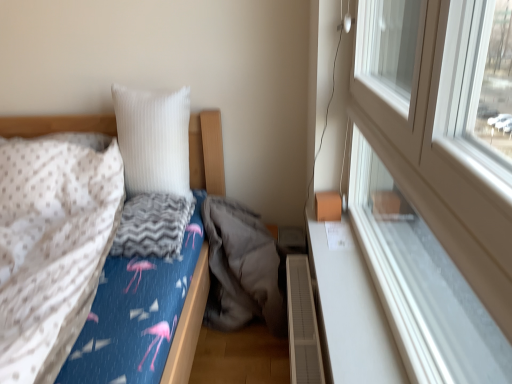
In order to click on white dotted fabric at left in this screenshot , I will do `click(52, 248)`.

What is the approximate width of white plastic window at upper right?

The width of white plastic window at upper right is 9.74 centimeters.

The image size is (512, 384). Describe the element at coordinates (302, 324) in the screenshot. I see `white plastic radiator at lower right` at that location.

Describe the element at coordinates (154, 140) in the screenshot. The image size is (512, 384). I see `white ribbed pillow at upper center` at that location.

The height and width of the screenshot is (384, 512). What do you see at coordinates (350, 313) in the screenshot?
I see `white smooth window sill at right` at bounding box center [350, 313].

Identify the location of gray zigzag blanket at center. (153, 226).

The image size is (512, 384). What do you see at coordinates (153, 226) in the screenshot?
I see `gray zigzag blanket at center` at bounding box center [153, 226].

This screenshot has height=384, width=512. What are the coordinates of `flamingo-patterned fabric bed at left` in the screenshot? It's located at tap(188, 325).

Image resolution: width=512 pixels, height=384 pixels. I want to click on white dotted fabric at left, so click(x=52, y=248).

Which is more to the right, flamingo-patterned fabric bed at left or gray soft sleeping bag at center?

gray soft sleeping bag at center is more to the right.

Is flamingo-patterned fabric bed at left positioned in front of gray soft sleeping bag at center?

Yes.

From a real-world perspective, is flamingo-patterned fabric bed at left located higher than gray soft sleeping bag at center?

Correct, in the physical world, flamingo-patterned fabric bed at left is higher than gray soft sleeping bag at center.

Based on the photo, is flamingo-patterned fabric bed at left wider than gray soft sleeping bag at center?

Correct, the width of flamingo-patterned fabric bed at left exceeds that of gray soft sleeping bag at center.

Which object is closer to the camera, gray soft sleeping bag at center or white smooth window sill at right?

Positioned in front is white smooth window sill at right.

From the picture: Can you confirm if gray soft sleeping bag at center is shorter than white smooth window sill at right?

No, gray soft sleeping bag at center is not shorter than white smooth window sill at right.

Does gray soft sleeping bag at center have a smaller size compared to white smooth window sill at right?

No.

Consider the image. Considering the positions of objects gray soft sleeping bag at center and white smooth window sill at right in the image provided, who is more to the left, gray soft sleeping bag at center or white smooth window sill at right?

gray soft sleeping bag at center.

Is point (170, 239) closer to camera compared to point (212, 193)?

Yes, it is.

In the image, is gray zigzag blanket at center positioned in front of or behind flamingo-patterned fabric bed at left?

gray zigzag blanket at center is behind flamingo-patterned fabric bed at left.

From the picture: Can you confirm if gray zigzag blanket at center is smaller than flamingo-patterned fabric bed at left?

Yes, gray zigzag blanket at center is smaller than flamingo-patterned fabric bed at left.

Considering the sizes of objects gray zigzag blanket at center and flamingo-patterned fabric bed at left in the image provided, who is taller, gray zigzag blanket at center or flamingo-patterned fabric bed at left?

flamingo-patterned fabric bed at left is taller.

From the image's perspective, is white smooth window sill at right over white plastic radiator at lower right?

Yes, from the image's perspective, white smooth window sill at right is over white plastic radiator at lower right.

Is white smooth window sill at right to the left of white plastic radiator at lower right from the viewer's perspective?

No, white smooth window sill at right is not to the left of white plastic radiator at lower right.

Between point (330, 251) and point (306, 343), which one is positioned in front?

Point (306, 343)

Would you consider white ribbed pillow at upper center to be distant from white plastic radiator at lower right?

No, white ribbed pillow at upper center is not far away from white plastic radiator at lower right.

How many degrees apart are the facing directions of white ribbed pillow at upper center and white plastic radiator at lower right?

white ribbed pillow at upper center and white plastic radiator at lower right are facing 89.7 degrees away from each other.

Is white ribbed pillow at upper center positioned with its back to white plastic radiator at lower right?

white ribbed pillow at upper center is not turned away from white plastic radiator at lower right.

Considering the relative sizes of white ribbed pillow at upper center and white plastic radiator at lower right in the image provided, is white ribbed pillow at upper center shorter than white plastic radiator at lower right?

No, white ribbed pillow at upper center is not shorter than white plastic radiator at lower right.

From a real-world perspective, between white plastic window at upper right and white smooth window sill at right, who is vertically higher?

white plastic window at upper right, from a real-world perspective.

From the image's perspective, is white plastic window at upper right on top of white smooth window sill at right?

Indeed, from the image's perspective, white plastic window at upper right is shown above white smooth window sill at right.

Between white plastic window at upper right and white smooth window sill at right, which one appears on the left side from the viewer's perspective?

From the viewer's perspective, white smooth window sill at right appears more on the left side.

How far apart are white dotted fabric at left and white smooth window sill at right?

white dotted fabric at left is 36.37 inches away from white smooth window sill at right.

From the image's perspective, which is below, white dotted fabric at left or white smooth window sill at right?

white smooth window sill at right appears lower in the image.

From a real-world perspective, is white dotted fabric at left above or below white smooth window sill at right?

In terms of real-world spatial position, white dotted fabric at left is above white smooth window sill at right.

Looking at this image, is white dotted fabric at left turned away from white smooth window sill at right?

No, white dotted fabric at left's orientation is not away from white smooth window sill at right.

Locate an element on the screen. This screenshot has height=384, width=512. sleeping bag above the flamingo-patterned fabric bed at left (from the image's perspective) is located at coordinates (241, 269).

This screenshot has height=384, width=512. Find the location of `window sill lying on the right of gray soft sleeping bag at center`. window sill lying on the right of gray soft sleeping bag at center is located at coordinates (350, 313).

Looking at the image, which one is located further to flamingo-patterned fabric bed at left, white ribbed pillow at upper center or white plastic radiator at lower right?

The object further to flamingo-patterned fabric bed at left is white ribbed pillow at upper center.

When comparing their distances from white dotted fabric at left, does white plastic radiator at lower right or white plastic window at upper right seem closer?

white plastic radiator at lower right.

Considering their positions, is white plastic window at upper right positioned further to white ribbed pillow at upper center than gray zigzag blanket at center?

white plastic window at upper right is further to white ribbed pillow at upper center.

Which object lies nearer to the anchor point gray soft sleeping bag at center, white plastic radiator at lower right or flamingo-patterned fabric bed at left?

flamingo-patterned fabric bed at left lies closer to gray soft sleeping bag at center than the other object.

From the image, which object appears to be nearer to white plastic radiator at lower right, white smooth window sill at right or flamingo-patterned fabric bed at left?

white smooth window sill at right lies closer to white plastic radiator at lower right than the other object.

Considering their positions, is white plastic radiator at lower right positioned closer to white smooth window sill at right than white dotted fabric at left?

white plastic radiator at lower right.

Considering their positions, is white smooth window sill at right positioned closer to gray soft sleeping bag at center than white dotted fabric at left?

white smooth window sill at right lies closer to gray soft sleeping bag at center than the other object.

Considering their positions, is white dotted fabric at left positioned further to white ribbed pillow at upper center than white smooth window sill at right?

Based on the image, white smooth window sill at right appears to be further to white ribbed pillow at upper center.

Locate an element on the screen. This screenshot has width=512, height=384. radiator situated between gray zigzag blanket at center and white smooth window sill at right from left to right is located at coordinates (302, 324).

Where is `blanket located between flamingo-patterned fabric bed at left and white smooth window sill at right in the left-right direction`? This screenshot has height=384, width=512. blanket located between flamingo-patterned fabric bed at left and white smooth window sill at right in the left-right direction is located at coordinates (52, 248).

Where is `window sill between white dotted fabric at left and white plastic window at upper right from left to right`? window sill between white dotted fabric at left and white plastic window at upper right from left to right is located at coordinates (350, 313).

At what (x,y) coordinates should I click in order to perform the action: click on blanket located between white plastic window at upper right and white ribbed pillow at upper center in the depth direction. Please return your answer as a coordinate pair (x, y). The image size is (512, 384). Looking at the image, I should click on (52, 248).